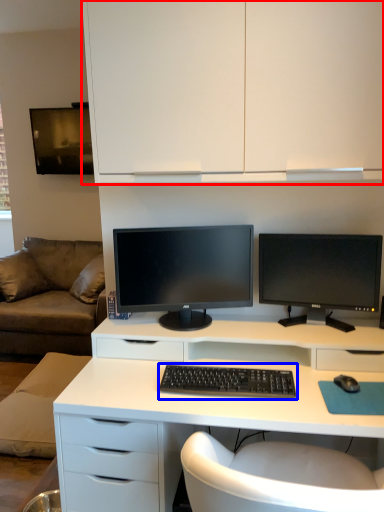
Question: Which of the following is the farthest to the observer, cabinetry (highlighted by a red box) or computer keyboard (highlighted by a blue box)?

Choices:
 (A) cabinetry
 (B) computer keyboard

Answer: (B)